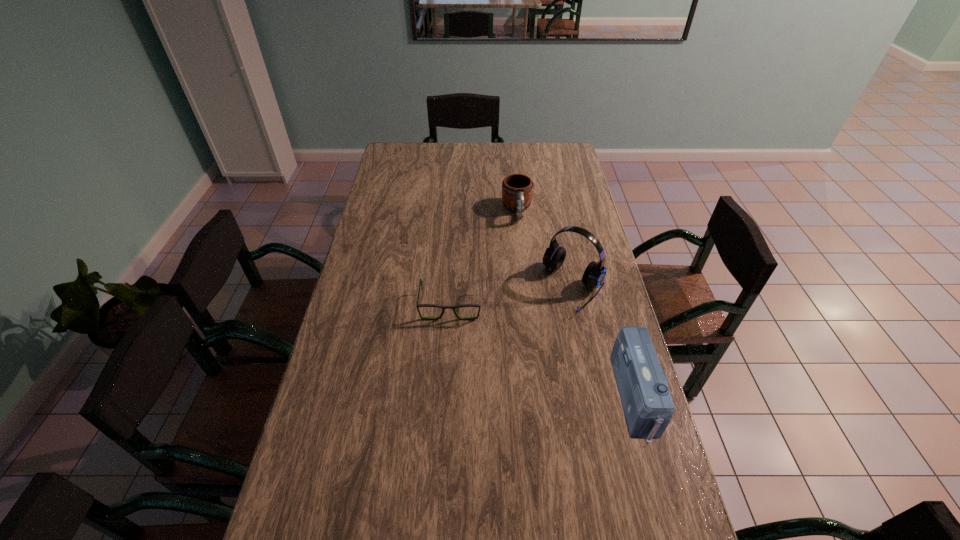
Locate an element on the screen. Image resolution: width=960 pixels, height=540 pixels. the shortest object is located at coordinates (420, 284).

What are the coordinates of `the leftmost object` in the screenshot? It's located at (420, 284).

Image resolution: width=960 pixels, height=540 pixels. Find the location of `the nearest object`. the nearest object is located at coordinates tap(642, 384).

I want to click on camera, so click(x=642, y=384).

Where is `the farthest object`? the farthest object is located at coordinates (517, 189).

This screenshot has height=540, width=960. Identify the location of the third tallest object. (517, 189).

This screenshot has height=540, width=960. I want to click on the tallest object, so click(x=554, y=256).

At what (x,y) coordinates should I click in order to perform the action: click on vacant area situated 0.270m on the lens of the leftmost object. Please return your answer as a coordinate pair (x, y). Looking at the image, I should click on (444, 396).

The height and width of the screenshot is (540, 960). In order to click on vacant space located 0.100m on the side of the third tallest object with the handle in this screenshot , I will do `click(521, 241)`.

The image size is (960, 540). Find the location of `vacant area situated on the side of the third tallest object with the handle`. vacant area situated on the side of the third tallest object with the handle is located at coordinates (524, 259).